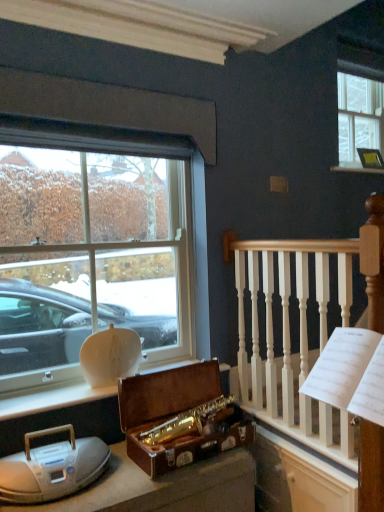
Question: Is clear glass window at upper right, positioned as the second window in left-to-right order, situated inside metallic gold picture frame at upper right or outside?

Choices:
 (A) inside
 (B) outside

Answer: (B)

Question: In the image, is clear glass window at upper right, which appears as the first window when viewed from the back, on the left side or the right side of metallic gold picture frame at upper right?

Choices:
 (A) left
 (B) right

Answer: (B)

Question: Which object is the closest to the clear glass window at upper right, the 1th window from the top?

Choices:
 (A) metallic gold picture frame at upper right
 (B) white plastic radio at lower left
 (C) clear glass window at upper left, which ranks as the 1th window in left-to-right order
 (D) wooden suitcase at center
 (E) white wood railing at upper right

Answer: (A)

Question: Which object is the closest to the metallic gold picture frame at upper right?

Choices:
 (A) wooden suitcase at center
 (B) clear glass window at upper right, which appears as the first window when viewed from the back
 (C) white wood railing at upper right
 (D) white plastic radio at lower left
 (E) clear glass window at upper left, positioned as the first window in bottom-to-top order

Answer: (B)